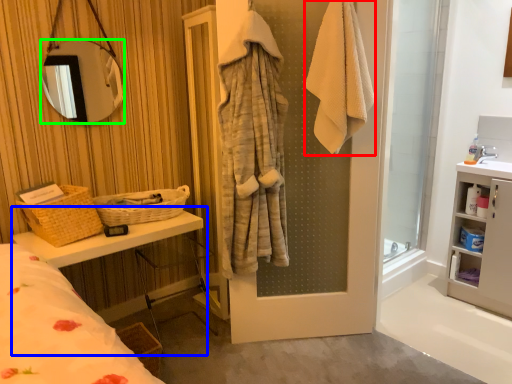
Question: Estimate the real-world distances between objects in this image. Which object is farther from bath towel (highlighted by a red box), vanity (highlighted by a blue box) or mirror (highlighted by a green box)?

Choices:
 (A) vanity
 (B) mirror

Answer: (B)